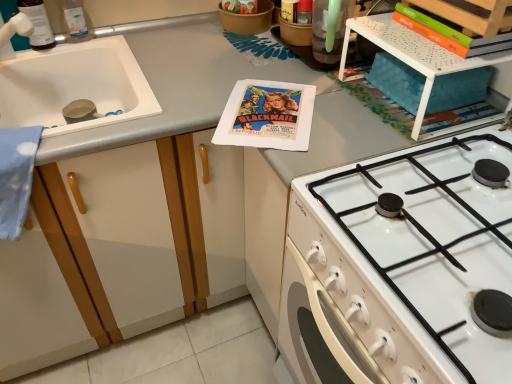
Question: Is translucent plastic bottle at upper left, the second bottle viewed from the right, inside or outside of white perforated plastic shelf at upper right?

Choices:
 (A) inside
 (B) outside

Answer: (B)

Question: Considering their positions, is translucent plastic bottle at upper left, which is the first bottle from left to right, located in front of or behind white perforated plastic shelf at upper right?

Choices:
 (A) behind
 (B) front

Answer: (A)

Question: Which object is positioned closest to the white glossy gas stove at lower right?

Choices:
 (A) orange matte book at upper right
 (B) white matte sink at left
 (C) white perforated plastic shelf at upper right
 (D) clear plastic bottle at upper left, the 2th bottle from the left
 (E) translucent plastic bottle at upper left, the second bottle viewed from the right

Answer: (C)

Question: Which object is positioned closest to the white glossy gas stove at lower right?

Choices:
 (A) translucent plastic bottle at upper left, the second bottle viewed from the right
 (B) white perforated plastic shelf at upper right
 (C) clear plastic bottle at upper left, which is counted as the 1th bottle, starting from the right
 (D) white matte sink at left
 (E) orange matte book at upper right

Answer: (B)